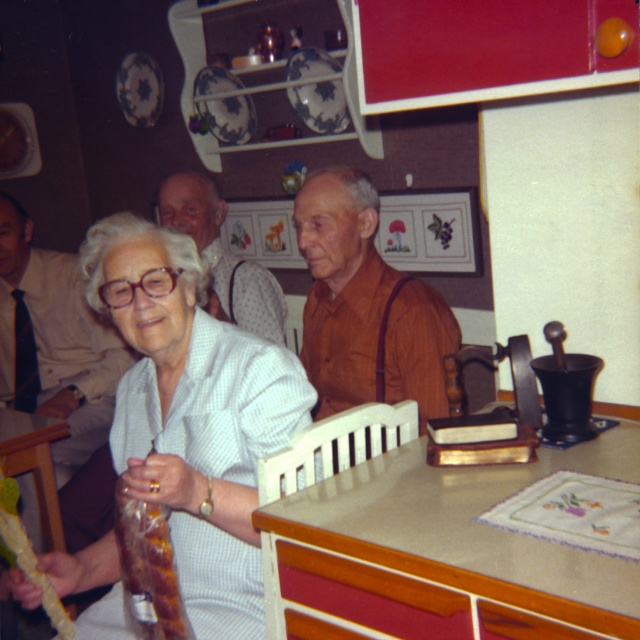
Question: Which of the following is the closest to the observer?

Choices:
 (A) (145, 522)
 (B) (122, 312)
 (C) (216, 280)
 (D) (68, 348)

Answer: (A)

Question: Which object is positioned farthest from the white shirt at upper left?

Choices:
 (A) brown leather jacket at upper center
 (B) brown leather shirt at center
 (C) shiny brown meat at lower left

Answer: (C)

Question: Is brown leather shirt at center above shiny brown meat at lower left?

Choices:
 (A) no
 (B) yes

Answer: (B)

Question: Can you confirm if beige laminate table at center is positioned above white shirt at upper left?

Choices:
 (A) no
 (B) yes

Answer: (A)

Question: Does brown leather shirt at center appear on the left side of shiny brown meat at lower left?

Choices:
 (A) no
 (B) yes

Answer: (A)

Question: Which object is positioned closest to the shiny brown meat at lower left?

Choices:
 (A) white shirt at upper left
 (B) brown leather jacket at upper center
 (C) beige laminate table at center

Answer: (C)